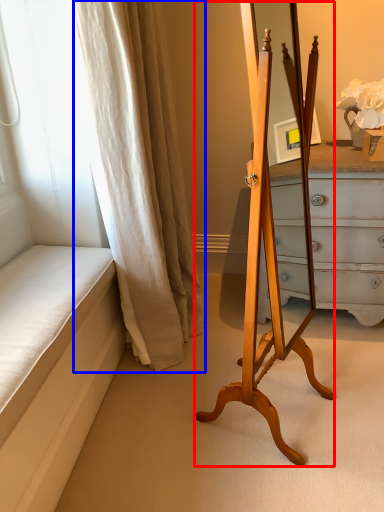
Question: Which object is further to the camera taking this photo, easel (highlighted by a red box) or curtain (highlighted by a blue box)?

Choices:
 (A) easel
 (B) curtain

Answer: (B)